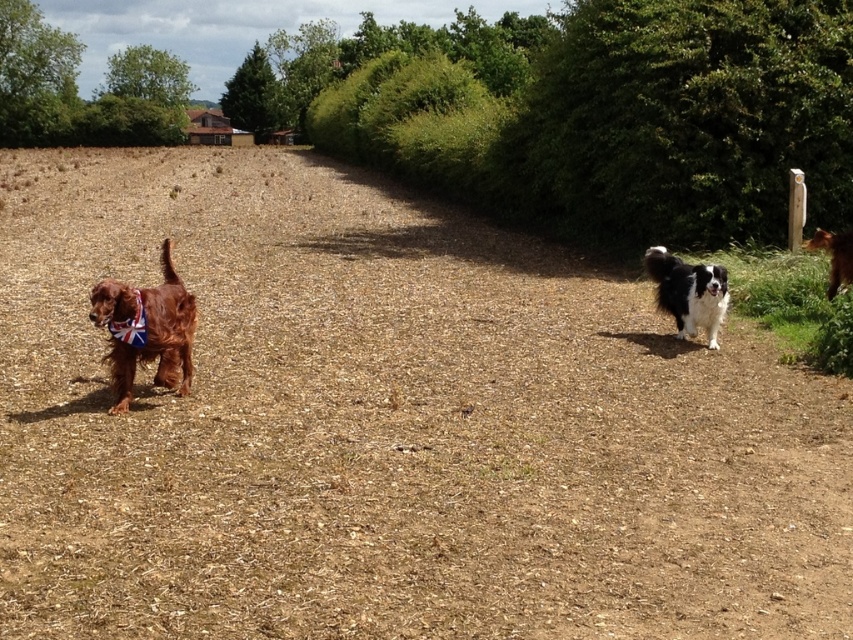
Question: Which of these objects is positioned farthest from the black and white fur at right?

Choices:
 (A) shiny brown dog at left
 (B) brown furry dog at right

Answer: (A)

Question: Does shiny brown dog at left have a larger size compared to brown furry dog at right?

Choices:
 (A) yes
 (B) no

Answer: (A)

Question: Estimate the real-world distances between objects in this image. Which object is farther from the brown furry dog at right?

Choices:
 (A) black and white fur at right
 (B) shiny brown dog at left

Answer: (B)

Question: Is shiny brown dog at left below brown furry dog at right?

Choices:
 (A) no
 (B) yes

Answer: (B)

Question: Does shiny brown dog at left have a larger size compared to brown furry dog at right?

Choices:
 (A) no
 (B) yes

Answer: (B)

Question: Which point is closer to the camera taking this photo?

Choices:
 (A) (831, 266)
 (B) (675, 294)

Answer: (B)